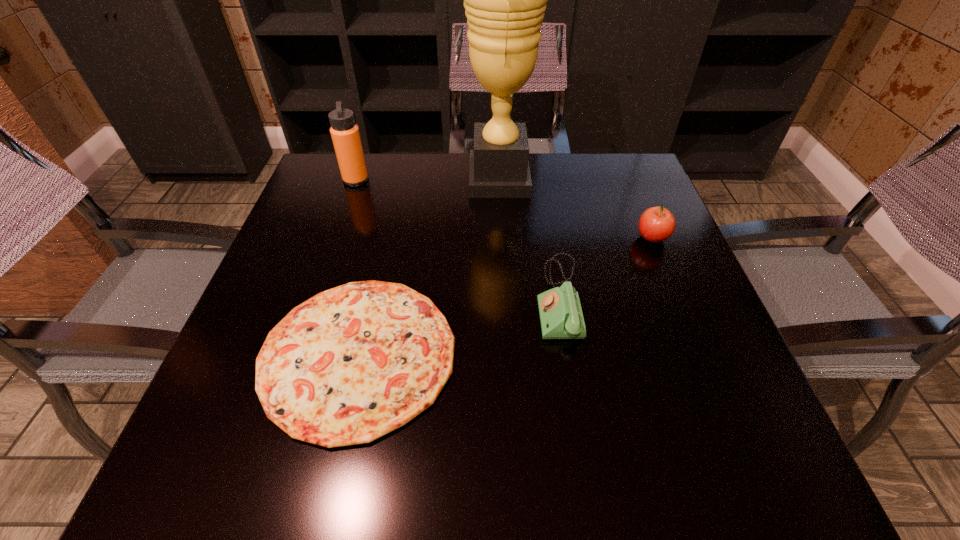
Identify the location of object that is at the right edge. This screenshot has width=960, height=540. (656, 224).

The image size is (960, 540). Find the location of `object present at the far left corner`. object present at the far left corner is located at coordinates (345, 134).

This screenshot has width=960, height=540. Identify the location of object present at the near left corner. (353, 363).

Where is `free space at the far edge of the desktop`? The image size is (960, 540). free space at the far edge of the desktop is located at coordinates (464, 167).

Locate an element on the screen. free space at the near edge of the desktop is located at coordinates (322, 458).

The height and width of the screenshot is (540, 960). I want to click on vacant space at the left edge, so click(308, 261).

I want to click on vacant space at the right edge of the desktop, so click(x=611, y=240).

The image size is (960, 540). What are the coordinates of `vacant space at the far left corner of the desktop` in the screenshot? It's located at (323, 190).

The height and width of the screenshot is (540, 960). In the image, there is a desktop. In order to click on free space at the near left corner in this screenshot , I will do pos(171,485).

What are the coordinates of `vacant region at the far right corner of the desktop` in the screenshot? It's located at (639, 160).